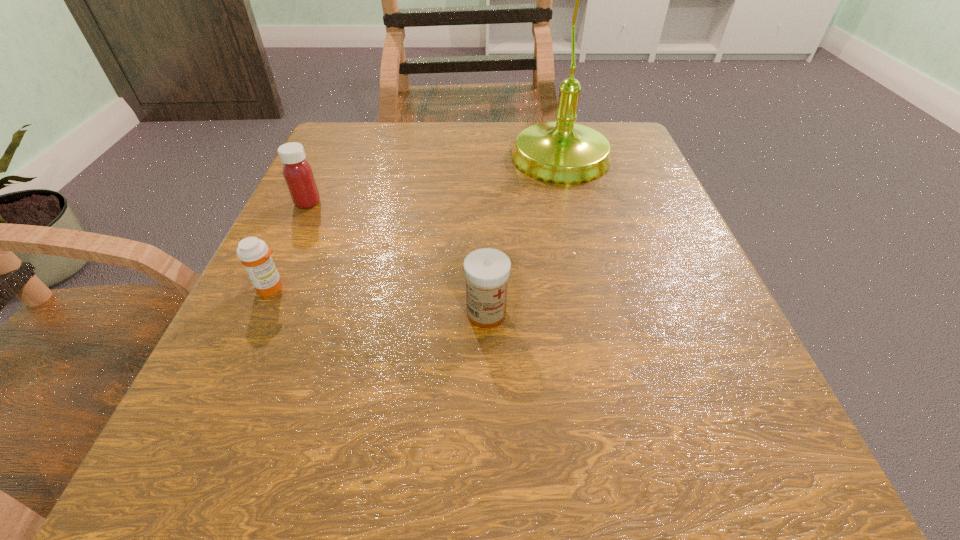
Identify the location of free area in between the farthest medicine and the tallest object. The width and height of the screenshot is (960, 540). (435, 183).

You are a GUI agent. You are given a task and a screenshot of the screen. Output one action in this format:
    pyautogui.click(x=<x>, y=<y>)
    Task: Click on the vacant space in between the farthest medicine and the nearest object
    The image size is (960, 540).
    Given the screenshot: What is the action you would take?
    tap(397, 258)

At what (x,y) coordinates should I click in order to perform the action: click on vacant space that is in between the farthest medicine and the lamp. Please return your answer as a coordinate pair (x, y). The height and width of the screenshot is (540, 960). Looking at the image, I should click on [x=435, y=183].

Where is `free spot between the farthest medicine and the third farthest object`? free spot between the farthest medicine and the third farthest object is located at coordinates (290, 245).

What are the coordinates of `free space between the nearest object and the lamp` in the screenshot? It's located at (524, 238).

Locate an element on the screen. free spot between the nearest object and the tallest object is located at coordinates (524, 238).

Locate an element on the screen. The width and height of the screenshot is (960, 540). free area in between the lamp and the second nearest medicine is located at coordinates (417, 225).

Find the location of a particular element. The height and width of the screenshot is (540, 960). vacant point located between the rightmost medicine and the farthest medicine is located at coordinates (397, 258).

At what (x,y) coordinates should I click in order to perform the action: click on vacant region between the second nearest object and the farthest medicine. Please return your answer as a coordinate pair (x, y). Image resolution: width=960 pixels, height=540 pixels. Looking at the image, I should click on (290, 245).

I want to click on object that is the second closest to the rightmost medicine, so click(253, 253).